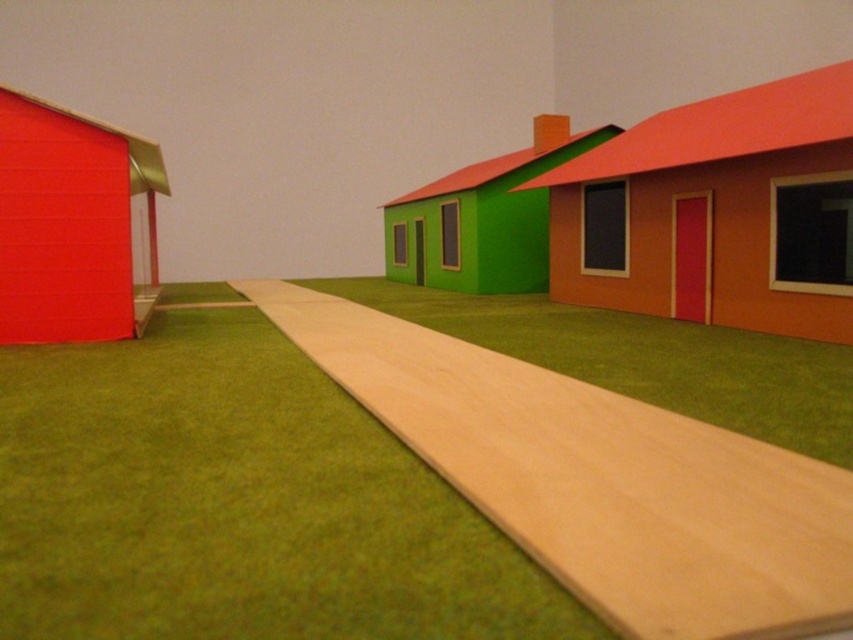
Is orange matte house at center-right wider than green matte house at center?

Incorrect, orange matte house at center-right's width does not surpass green matte house at center's.

Is orange matte house at center-right taller than green matte house at center?

No.

Image resolution: width=853 pixels, height=640 pixels. Identify the location of orange matte house at center-right. (717, 211).

Can you confirm if smooth wooden path at center is positioned below orange matte house at center-right?

Yes.

Is smooth wooden path at center taller than orange matte house at center-right?

No, smooth wooden path at center is not taller than orange matte house at center-right.

The height and width of the screenshot is (640, 853). Describe the element at coordinates (598, 477) in the screenshot. I see `smooth wooden path at center` at that location.

Identify the location of smooth wooden path at center. (598, 477).

Consider the image. Which is more to the right, smooth wooden path at center or green matte house at center?

green matte house at center is more to the right.

Is smooth wooden path at center to the right of green matte house at center from the viewer's perspective?

No, smooth wooden path at center is not to the right of green matte house at center.

This screenshot has width=853, height=640. What do you see at coordinates (598, 477) in the screenshot?
I see `smooth wooden path at center` at bounding box center [598, 477].

Where is `smooth wooden path at center`? The image size is (853, 640). smooth wooden path at center is located at coordinates (598, 477).